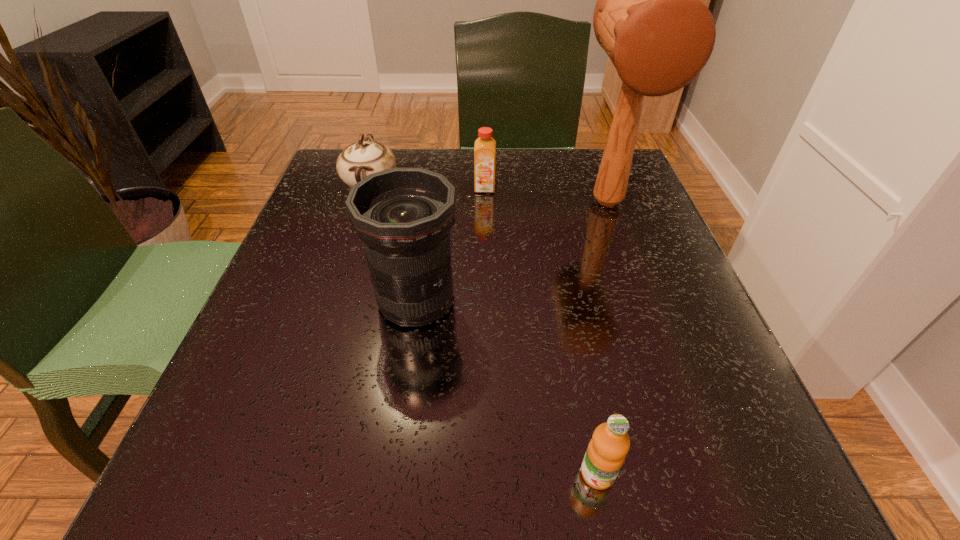
At what (x,y) coordinates should I click in order to perform the action: click on unoccupied area between the leftmost object and the rightmost object. Please return your answer as a coordinate pair (x, y). The image size is (960, 540). Looking at the image, I should click on (490, 194).

You are a GUI agent. You are given a task and a screenshot of the screen. Output one action in this format:
    pyautogui.click(x=<x>, y=<y>)
    Task: Click on the vacant region between the rightmost object and the leftmost object
    The image size is (960, 540).
    Given the screenshot: What is the action you would take?
    pyautogui.click(x=490, y=194)

At what (x,y) coordinates should I click in order to perform the action: click on empty space between the third object from right to left and the fourth object from left to right. Please return your answer as a coordinate pair (x, y). The width and height of the screenshot is (960, 540). Looking at the image, I should click on (541, 331).

Find the location of a particular element. vacant point located between the tallest object and the telephoto lens is located at coordinates (512, 252).

Identify the location of object that stands as the closest to the tallest object. (485, 146).

The image size is (960, 540). Find the location of `object that stands as the third closest to the fourth object from left to right`. object that stands as the third closest to the fourth object from left to right is located at coordinates (485, 146).